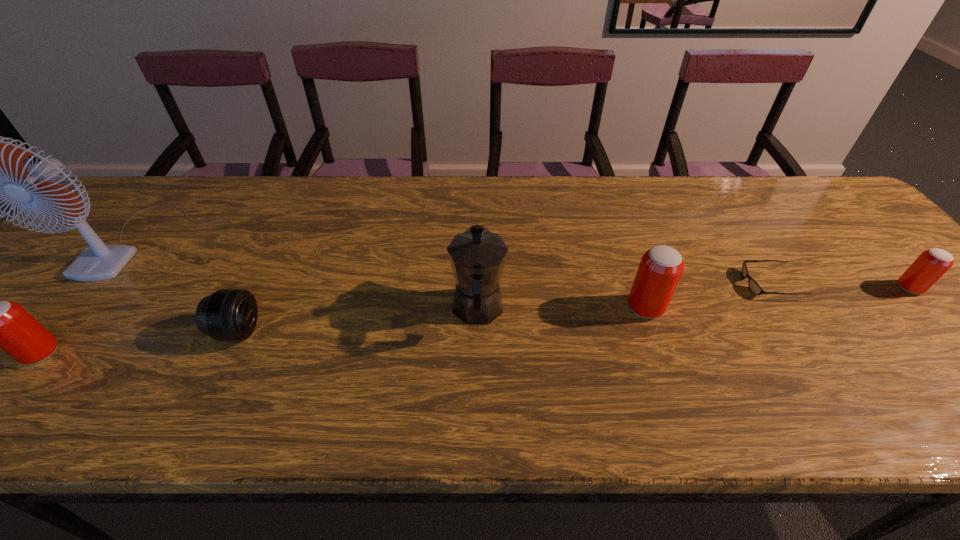
Identify the location of the nearest beer can. (3, 324).

Find the location of a particular element. The image size is (960, 540). the leftmost beer can is located at coordinates (3, 324).

Where is `the third tallest object`? the third tallest object is located at coordinates (660, 269).

You are a GUI agent. You are given a task and a screenshot of the screen. Output one action in this format:
    pyautogui.click(x=<x>, y=<y>)
    Task: Click on the tallest beer can
    
    Given the screenshot: What is the action you would take?
    pyautogui.click(x=660, y=269)

At what (x,y) coordinates should I click in order to perform the action: click on the shortest beer can. Please return your answer as a coordinate pair (x, y). The width and height of the screenshot is (960, 540). Looking at the image, I should click on (932, 264).

This screenshot has height=540, width=960. What are the coordinates of `the rightmost object` in the screenshot? It's located at (932, 264).

Identify the location of the tallest object. The image size is (960, 540). (97, 262).

You are a GUI agent. You are given a task and a screenshot of the screen. Output one action in this format:
    pyautogui.click(x=<x>, y=<y>)
    Task: Click on the fifth object from right to left
    
    Given the screenshot: What is the action you would take?
    pyautogui.click(x=228, y=314)

Where is `sunglasses`? The image size is (960, 540). sunglasses is located at coordinates (752, 284).

At what (x,y) coordinates should I click in order to perform the action: click on the shortest object. Please return your answer as a coordinate pair (x, y). This screenshot has width=960, height=540. Looking at the image, I should click on (752, 284).